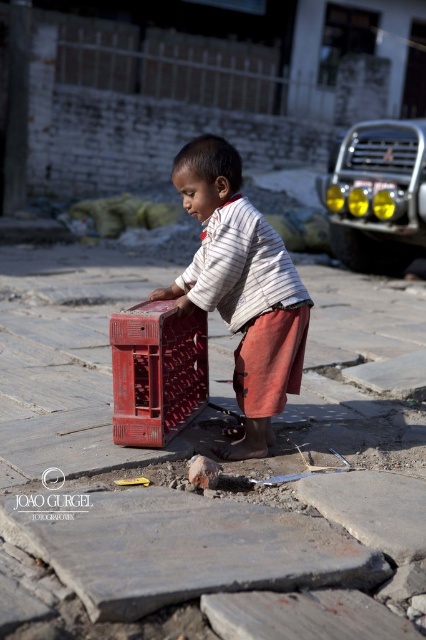
You are a delivery person who needs to place a 1.2 meter long package between the smooth stone pavement at center and the matte plastic crate at center. Is there enough space to fit the package without moving either object?

The smooth stone pavement at center is 1.07 meters away from the matte plastic crate at center. Since the package is 1.2 meters long, which is longer than the available space between them, the package cannot be placed there without moving either object.

You are a delivery person who needs to place a package on the smooth stone pavement at center and the matte plastic crate at center. Which surface can accommodate the package if it requires a larger area?

The matte plastic crate at center has a larger size than the smooth stone pavement at center, so the package should be placed on the matte plastic crate at center to accommodate its size requirements.

What are the coordinates of the matte plastic crate at center?

The coordinates of the matte plastic crate at center are at point [241,288].